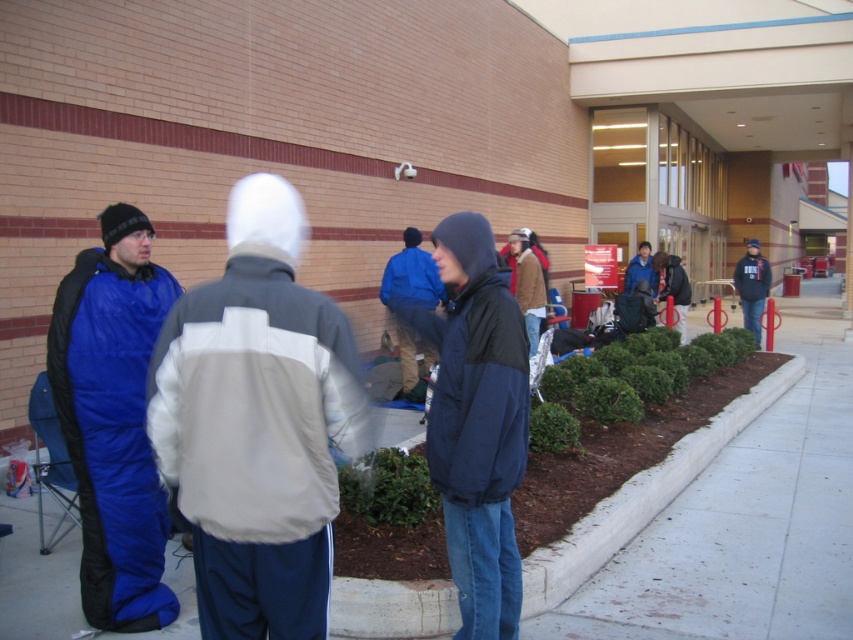
Question: Which object is the farthest from the blue sleeping bag at left?

Choices:
 (A) dark blue jacket at center
 (B) blue fleece jacket at center
 (C) gray/white fabric jacket at center
 (D) dark gray hoodie at center

Answer: (D)

Question: Which point is closer to the camera?

Choices:
 (A) (196, 340)
 (B) (744, 300)

Answer: (A)

Question: Where is blue sleeping bag at left located in relation to blue fleece jacket at center in the image?

Choices:
 (A) left
 (B) right

Answer: (A)

Question: Is the position of gray/white fabric jacket at center less distant than that of blue sleeping bag at left?

Choices:
 (A) no
 (B) yes

Answer: (B)

Question: Which point is farther to the camera?

Choices:
 (A) (177, 442)
 (B) (451, 541)
 (C) (419, 260)

Answer: (C)

Question: Can you confirm if blue sleeping bag at left is positioned below blue fleece jacket at center?

Choices:
 (A) yes
 (B) no

Answer: (A)